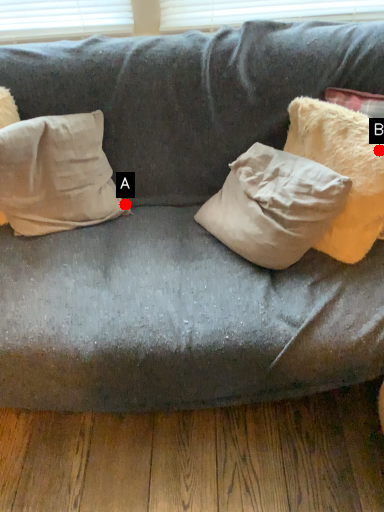
Question: Two points are circled on the image, labeled by A and B beside each circle. Which point is closer to the camera taking this photo?

Choices:
 (A) A is closer
 (B) B is closer

Answer: (B)